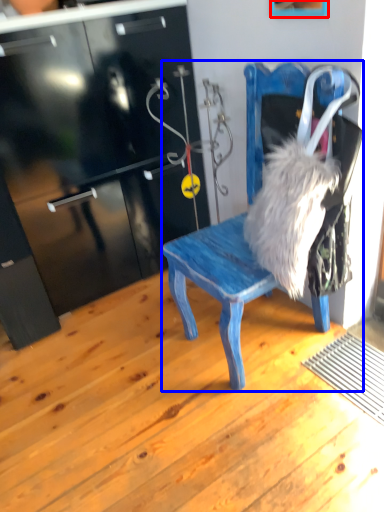
Question: Among these objects, which one is nearest to the camera, picture frame (highlighted by a red box) or chair (highlighted by a blue box)?

Choices:
 (A) picture frame
 (B) chair

Answer: (B)